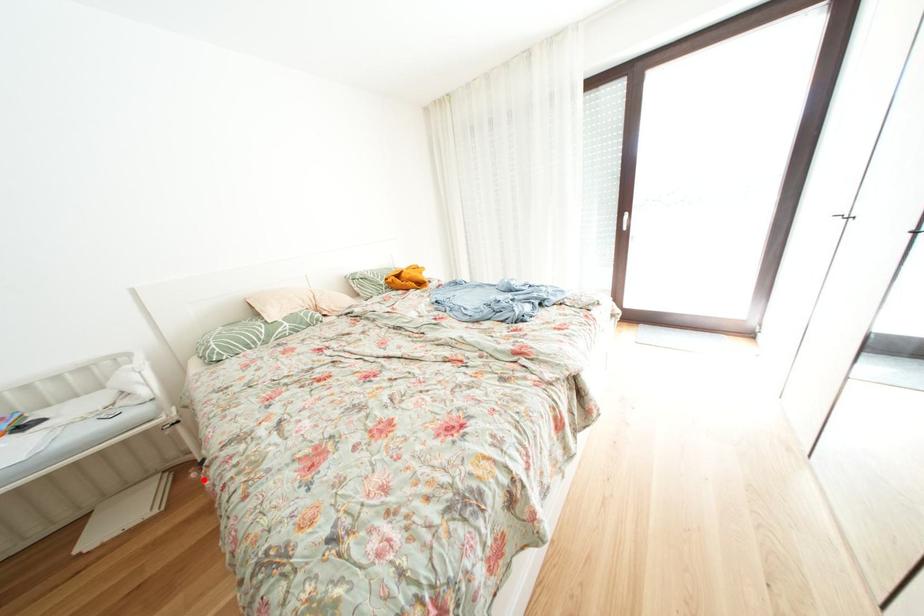
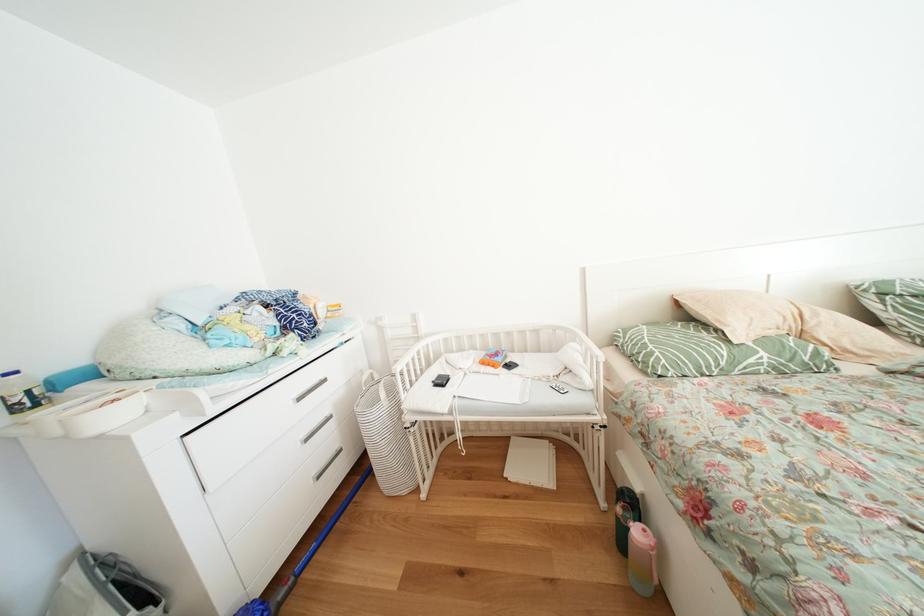
The point at the highlighted location is marked in the first image. Where is the corresponding point in the second image?

(628, 515)